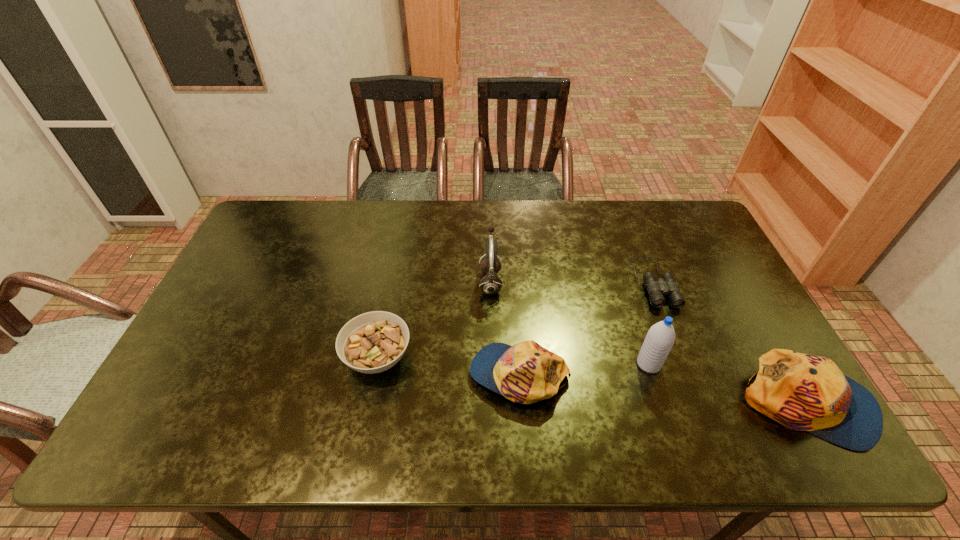
At what (x,y) coordinates should I click in order to perform the action: click on the shorter cap. Please return your answer as a coordinate pair (x, y). The width and height of the screenshot is (960, 540). Looking at the image, I should click on click(x=525, y=373).

Find the location of a particular element. This screenshot has width=960, height=540. the fourth tallest object is located at coordinates (525, 373).

Find the location of a particular element. the right cap is located at coordinates (804, 392).

At what (x,y) coordinates should I click in order to perform the action: click on the taller cap. Please return your answer as a coordinate pair (x, y). Image resolution: width=960 pixels, height=540 pixels. Looking at the image, I should click on (804, 392).

This screenshot has height=540, width=960. I want to click on the shortest object, so click(x=666, y=285).

Find the location of a particular element. binoculars is located at coordinates (666, 285).

Where is `earphone`? This screenshot has height=540, width=960. earphone is located at coordinates (490, 284).

I want to click on the fifth tallest object, so click(373, 342).

The width and height of the screenshot is (960, 540). I want to click on the leftmost object, so click(x=373, y=342).

Find the location of a particular element. the third object from right to left is located at coordinates (660, 338).